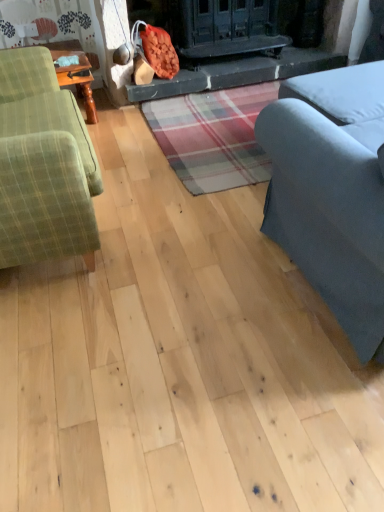
Question: In terms of width, does gray fabric couch at right, marked as the second studio couch in a left-to-right arrangement, look wider or thinner when compared to green plaid fabric couch at left, the 2th studio couch positioned from the right?

Choices:
 (A) thin
 (B) wide

Answer: (B)

Question: From their relative heights in the image, would you say gray fabric couch at right, marked as the second studio couch in a left-to-right arrangement, is taller or shorter than green plaid fabric couch at left, acting as the first studio couch starting from the left?

Choices:
 (A) tall
 (B) short

Answer: (A)

Question: Based on their relative distances, which object is farther from the green plaid fabric couch at left, the 2th studio couch positioned from the right?

Choices:
 (A) smooth stone fireplace at center
 (B) gray fabric couch at right, the 1th studio couch viewed from the right

Answer: (A)

Question: Which of these objects is positioned closest to the green plaid fabric couch at left, the 2th studio couch positioned from the right?

Choices:
 (A) smooth stone fireplace at center
 (B) gray fabric couch at right, the 1th studio couch viewed from the right

Answer: (B)